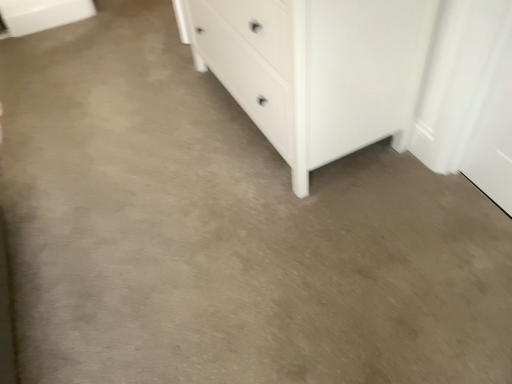
Question: Would you say white matte chest of drawers at center contains white matte cabinet at upper left?

Choices:
 (A) yes
 (B) no

Answer: (B)

Question: Can you confirm if white matte chest of drawers at center is thinner than white matte cabinet at upper left?

Choices:
 (A) yes
 (B) no

Answer: (B)

Question: Considering the relative sizes of white matte chest of drawers at center and white matte cabinet at upper left in the image provided, is white matte chest of drawers at center wider than white matte cabinet at upper left?

Choices:
 (A) yes
 (B) no

Answer: (A)

Question: Does white matte chest of drawers at center have a smaller size compared to white matte cabinet at upper left?

Choices:
 (A) yes
 (B) no

Answer: (B)

Question: Is white matte chest of drawers at center oriented away from white matte cabinet at upper left?

Choices:
 (A) yes
 (B) no

Answer: (B)

Question: From a real-world perspective, is white matte chest of drawers at center on top of white matte cabinet at upper left?

Choices:
 (A) yes
 (B) no

Answer: (A)

Question: From the image's perspective, is white matte cabinet at upper left beneath white matte chest of drawers at center?

Choices:
 (A) yes
 (B) no

Answer: (B)

Question: Can you confirm if white matte cabinet at upper left is shorter than white matte chest of drawers at center?

Choices:
 (A) yes
 (B) no

Answer: (A)

Question: Is the depth of white matte cabinet at upper left greater than that of white matte chest of drawers at center?

Choices:
 (A) no
 (B) yes

Answer: (B)

Question: Does white matte cabinet at upper left have a lesser width compared to white matte chest of drawers at center?

Choices:
 (A) yes
 (B) no

Answer: (A)

Question: Is white matte cabinet at upper left at the left side of white matte chest of drawers at center?

Choices:
 (A) yes
 (B) no

Answer: (A)

Question: Can you confirm if white matte cabinet at upper left is smaller than white matte chest of drawers at center?

Choices:
 (A) no
 (B) yes

Answer: (B)

Question: From a real-world perspective, is white matte cabinet at upper left physically located above or below white matte chest of drawers at center?

Choices:
 (A) below
 (B) above

Answer: (A)